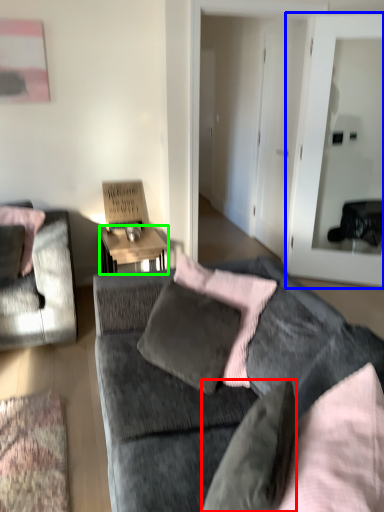
Question: Based on their relative distances, which object is nearer to pillow (highlighted by a red box)? Choose from glass door (highlighted by a blue box) and desk (highlighted by a green box).

Choices:
 (A) glass door
 (B) desk

Answer: (B)